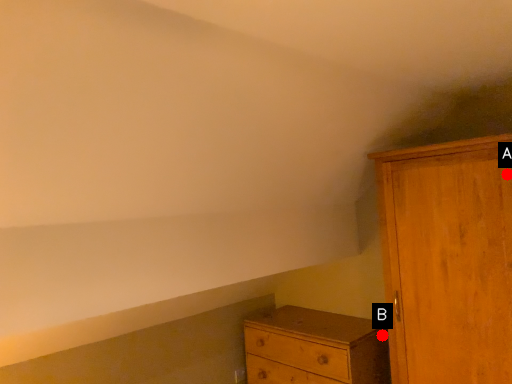
Question: Two points are circled on the image, labeled by A and B beside each circle. Which point is farther from the camera taking this photo?

Choices:
 (A) A is further
 (B) B is further

Answer: (B)